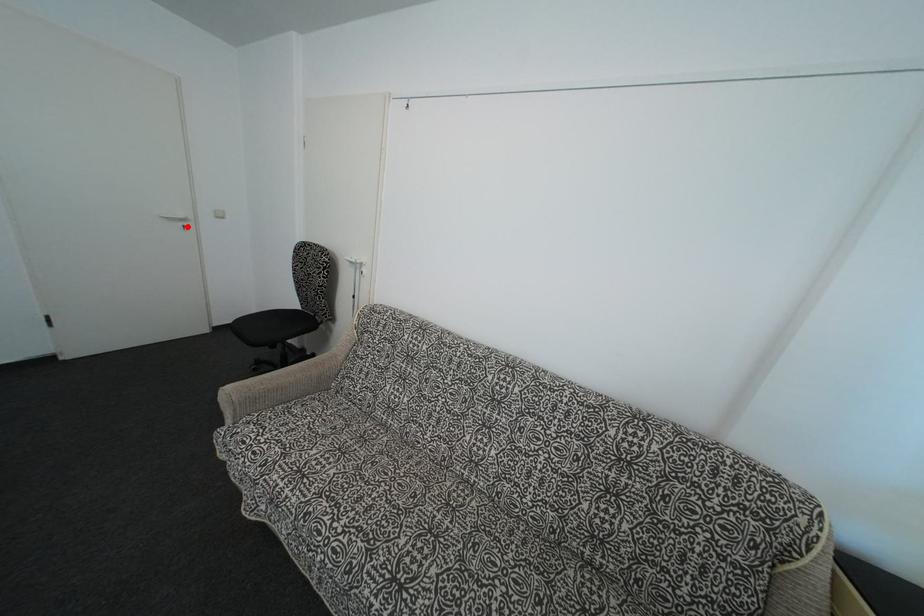
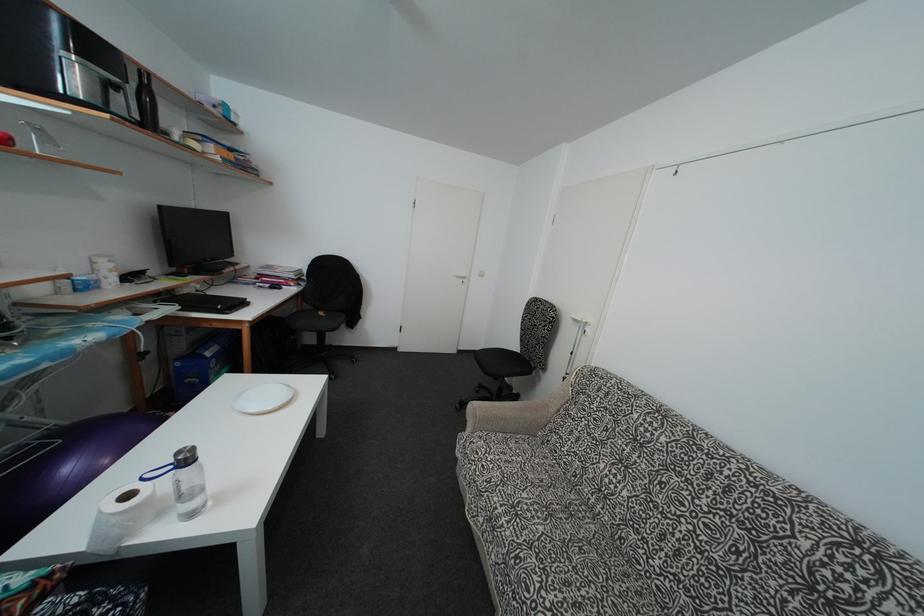
Question: I am providing you with two images of the same scene from different viewpoints. A red point is marked on the first image. At the location where the point appears in image 1, is it still visible in image 2?

Choices:
 (A) Yes
 (B) No

Answer: (A)